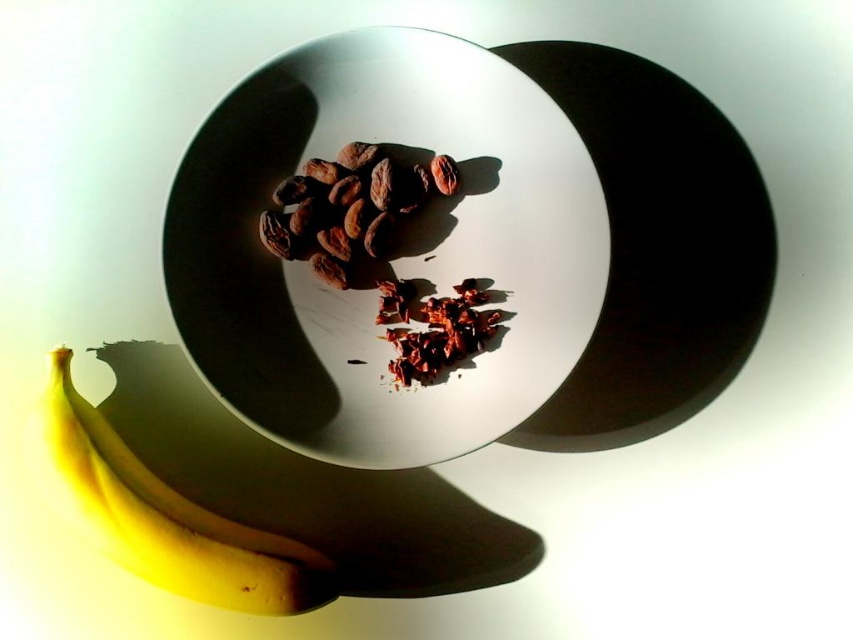
Question: Which of the following is the farthest from the observer?

Choices:
 (A) 425,305
 (B) 439,168

Answer: (A)

Question: Is yellow matte bananas at lower left closer to the viewer compared to brown matte chocolate at center?

Choices:
 (A) yes
 (B) no

Answer: (A)

Question: Considering the real-world distances, which object is closest to the white glossy plate at center?

Choices:
 (A) dark red crumbly chocolate at center
 (B) brown matte chocolate at center
 (C) yellow matte bananas at lower left

Answer: (B)

Question: Estimate the real-world distances between objects in this image. Which object is farther from the brown matte chocolate at center?

Choices:
 (A) white glossy plate at center
 (B) dark red crumbly chocolate at center

Answer: (B)

Question: Does yellow matte bananas at lower left appear over dark red crumbly chocolate at center?

Choices:
 (A) yes
 (B) no

Answer: (B)

Question: Is white glossy plate at center bigger than yellow matte bananas at lower left?

Choices:
 (A) yes
 (B) no

Answer: (A)